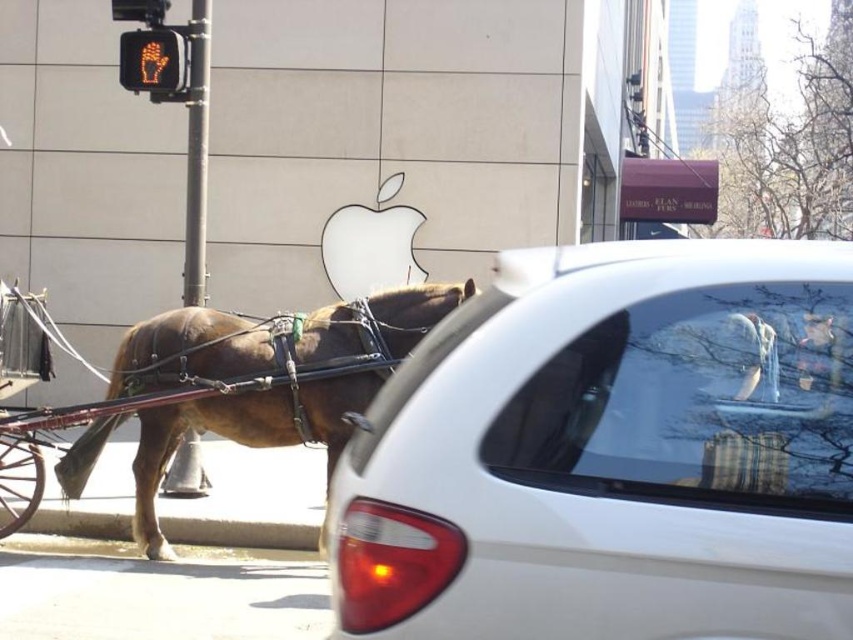
You are a delivery person needing to park your delivery van between the white glossy car at center and the brown leather horse at left. Can your van, which is 2 meters wide, fit in the space between them?

The white glossy car at center is thinner than the brown leather horse at left. However, without knowing the exact width of the space between them, it is impossible to determine if the van can fit. Please check the actual distance between the two objects.

You are a delivery person who needs to park your delivery van between the white glossy car at center and the brown leather horse at left. The van is 12 feet long. Is there enough space between them to park your van?

The distance between the white glossy car at center and the brown leather horse at left is 13.18 feet. Since the van is 12 feet long, there is enough space to park the van between them.